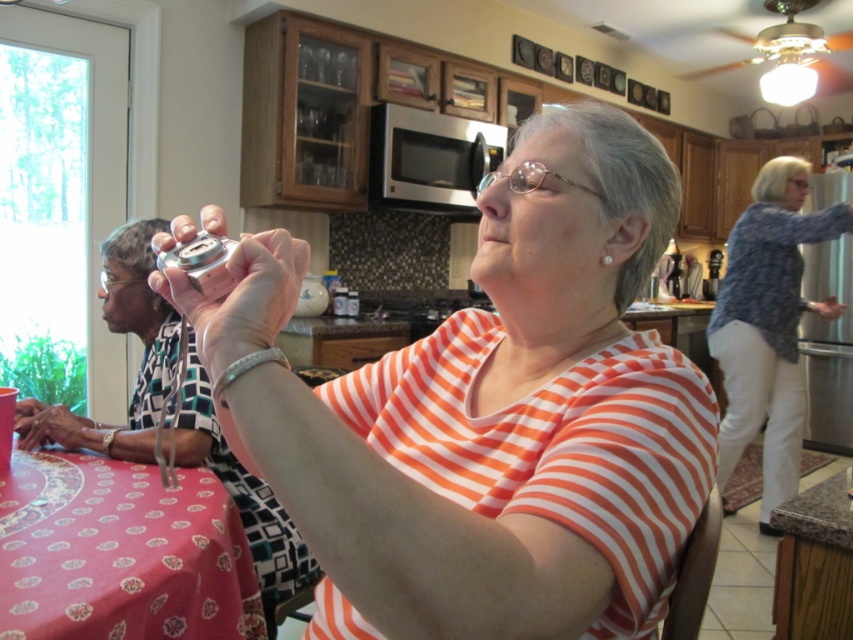
You are standing in the kitchen and want to reach the pink fabric tablecloth at lower left to adjust it. If your outstretched hand can reach up to 70 centimeters, will you be able to touch it?

The pink fabric tablecloth at lower left is 78.37 centimeters away from the viewer. Since your hand can only reach up to 70 centimeters, you won

You are organizing a dinner party and need to decide where to place the centerpiece. The pink fabric tablecloth at lower left and the granite countertop at lower right are both options. Which surface can accommodate a wider centerpiece?

The pink fabric tablecloth at lower left might be wider than granite countertop at lower right, so it can accommodate a wider centerpiece.